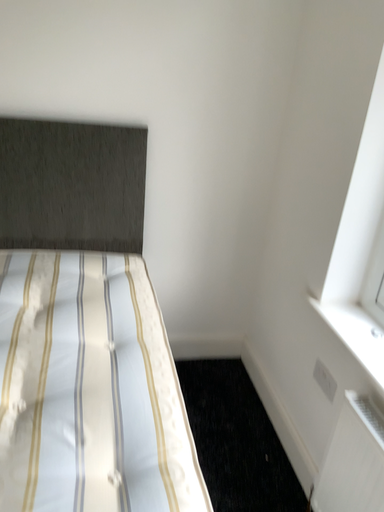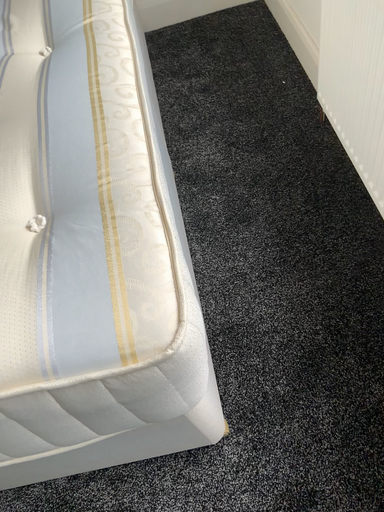
Question: Which way did the camera rotate in the video?

Choices:
 (A) rotated downward
 (B) rotated upward

Answer: (A)